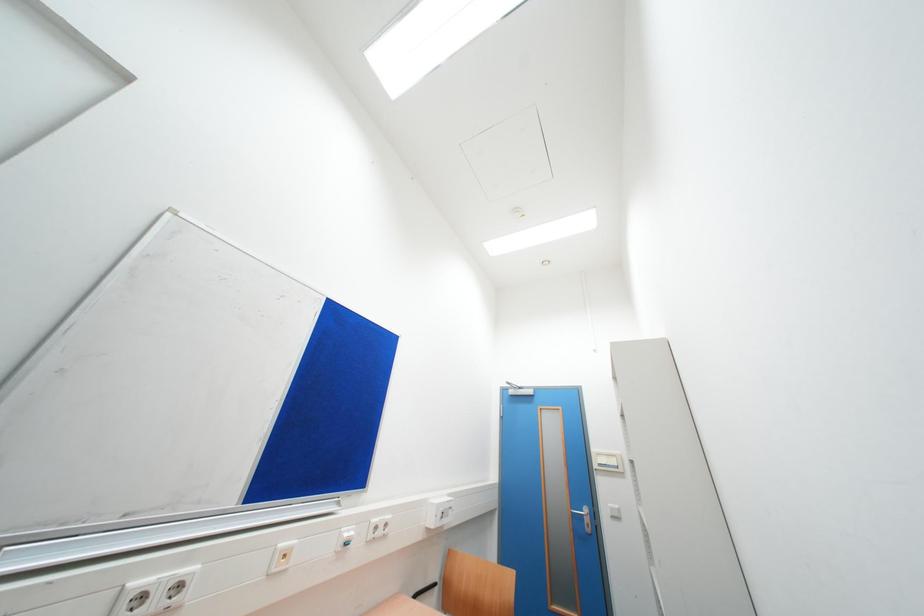
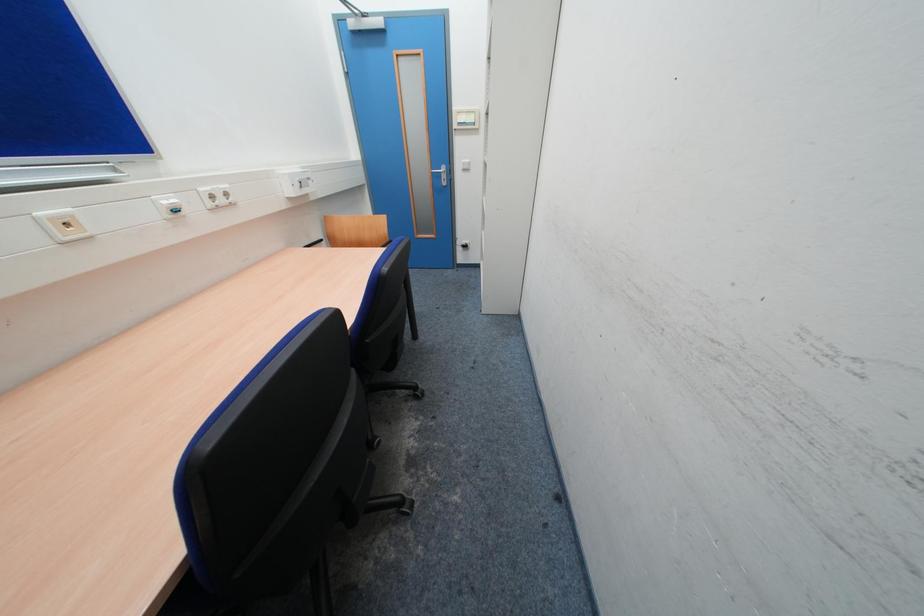
First-person continuous shooting, in which direction is the camera rotating?

The camera rotated toward right-down.